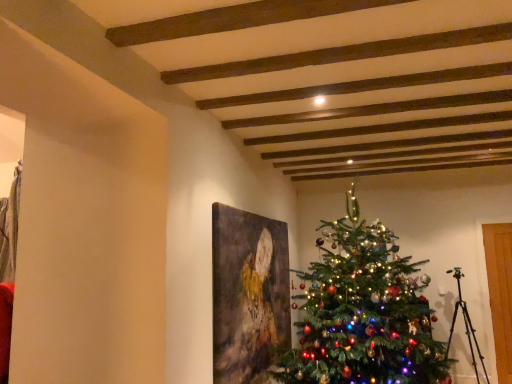
Question: In the image, is matte canvas painting at center on the left side or the right side of green matte christmas tree at center?

Choices:
 (A) left
 (B) right

Answer: (A)

Question: Is matte canvas painting at center wider or thinner than green matte christmas tree at center?

Choices:
 (A) wide
 (B) thin

Answer: (B)

Question: Which is correct: matte canvas painting at center is inside green matte christmas tree at center, or outside of it?

Choices:
 (A) outside
 (B) inside

Answer: (A)

Question: From a real-world perspective, is green matte christmas tree at center positioned above or below matte canvas painting at center?

Choices:
 (A) above
 (B) below

Answer: (A)

Question: Does point (387, 340) appear closer or farther from the camera than point (266, 327)?

Choices:
 (A) closer
 (B) farther

Answer: (A)

Question: In the image, is green matte christmas tree at center positioned in front of or behind matte canvas painting at center?

Choices:
 (A) front
 (B) behind

Answer: (A)

Question: Considering the positions of green matte christmas tree at center and matte canvas painting at center in the image, is green matte christmas tree at center bigger or smaller than matte canvas painting at center?

Choices:
 (A) big
 (B) small

Answer: (A)